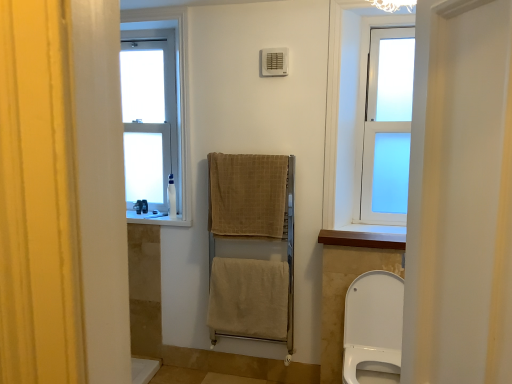
Question: Is white glossy toilet at lower right thinner than white plastic window sill at center, placed as the 2th window sill when sorted from bottom to top?

Choices:
 (A) yes
 (B) no

Answer: (B)

Question: Does white glossy toilet at lower right have a larger size compared to white plastic window sill at center, the 2th window sill in the right-to-left sequence?

Choices:
 (A) yes
 (B) no

Answer: (A)

Question: From the image's perspective, is white glossy toilet at lower right over white plastic window sill at center, the 2th window sill in the right-to-left sequence?

Choices:
 (A) no
 (B) yes

Answer: (A)

Question: Is white glossy toilet at lower right positioned with its back to white plastic window sill at center, positioned as the first window sill in left-to-right order?

Choices:
 (A) yes
 (B) no

Answer: (B)

Question: From a real-world perspective, does white glossy toilet at lower right stand above white plastic window sill at center, the 1th window sill viewed from the top?

Choices:
 (A) no
 (B) yes

Answer: (A)

Question: Is white glossy toilet at lower right behind white plastic window sill at center, positioned as the first window sill in left-to-right order?

Choices:
 (A) no
 (B) yes

Answer: (A)

Question: Is white plastic bottle at left, the 1th toiletry when ordered from front to back, a part of white plastic bottle at left, arranged as the second toiletry when viewed from the right?

Choices:
 (A) no
 (B) yes

Answer: (A)

Question: Is white plastic bottle at left, arranged as the second toiletry when viewed from the right, shorter than white plastic bottle at left, which is counted as the 1th toiletry, starting from the right?

Choices:
 (A) no
 (B) yes

Answer: (B)

Question: Is white plastic bottle at left, the first toiletry from the left, taller than white plastic bottle at left, the 1th toiletry when ordered from front to back?

Choices:
 (A) yes
 (B) no

Answer: (B)

Question: From a real-world perspective, does white plastic bottle at left, arranged as the second toiletry when viewed from the right, sit lower than white plastic bottle at left, which is the second toiletry from back to front?

Choices:
 (A) yes
 (B) no

Answer: (A)

Question: Is white plastic bottle at left, arranged as the second toiletry when viewed from the right, outside white plastic bottle at left, which is counted as the 1th toiletry, starting from the right?

Choices:
 (A) no
 (B) yes

Answer: (B)

Question: From the image's perspective, does white plastic bottle at left, arranged as the second toiletry when viewed from the right, appear lower than white plastic bottle at left, which is the second toiletry from back to front?

Choices:
 (A) yes
 (B) no

Answer: (A)

Question: Is white frosted glass window at upper right, the first window in the front-to-back sequence, not within wooden at upper center, placed as the 1th window sill when sorted from front to back?

Choices:
 (A) yes
 (B) no

Answer: (A)